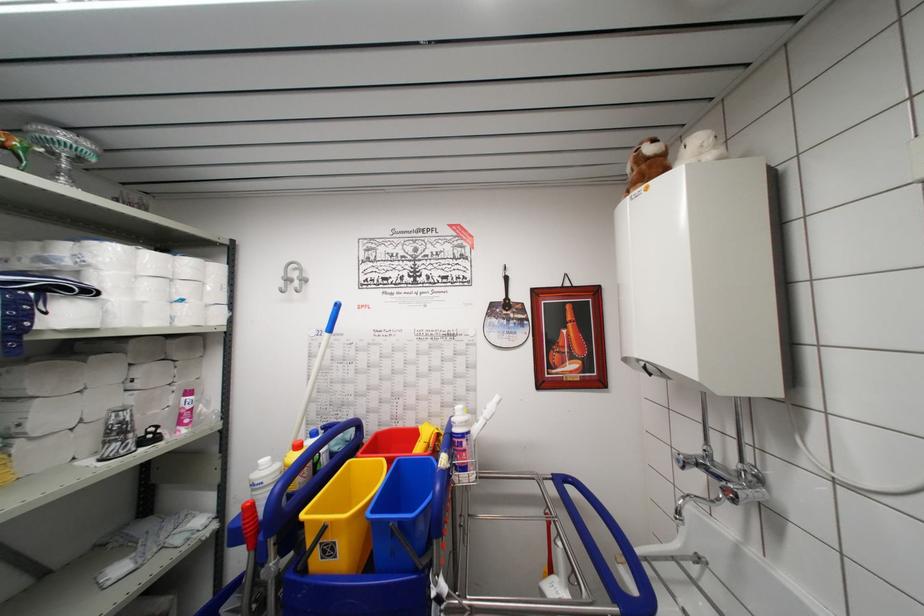
Find the location of a particular element. The width and height of the screenshot is (924, 616). black fan is located at coordinates (505, 321).